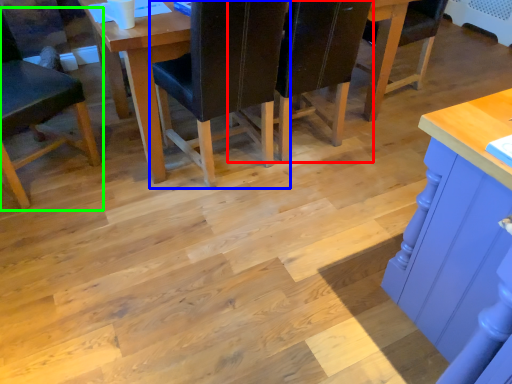
Question: Which is nearer to the chair (highlighted by a red box)? chair (highlighted by a blue box) or chair (highlighted by a green box).

Choices:
 (A) chair
 (B) chair

Answer: (A)